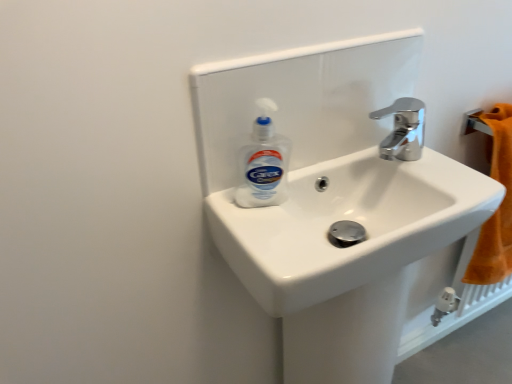
Question: Considering the positions of chrome metallic faucet at upper right and white glossy sink at center in the image, is chrome metallic faucet at upper right wider or thinner than white glossy sink at center?

Choices:
 (A) wide
 (B) thin

Answer: (B)

Question: From their relative heights in the image, would you say chrome metallic faucet at upper right is taller or shorter than white glossy sink at center?

Choices:
 (A) short
 (B) tall

Answer: (A)

Question: Estimate the real-world distances between objects in this image. Which object is farther from the white plastic bottle at center?

Choices:
 (A) white glossy sink at center
 (B) chrome metallic faucet at upper right

Answer: (B)

Question: Which is farther from the white glossy sink at center?

Choices:
 (A) chrome metallic faucet at upper right
 (B) white plastic bottle at center

Answer: (A)